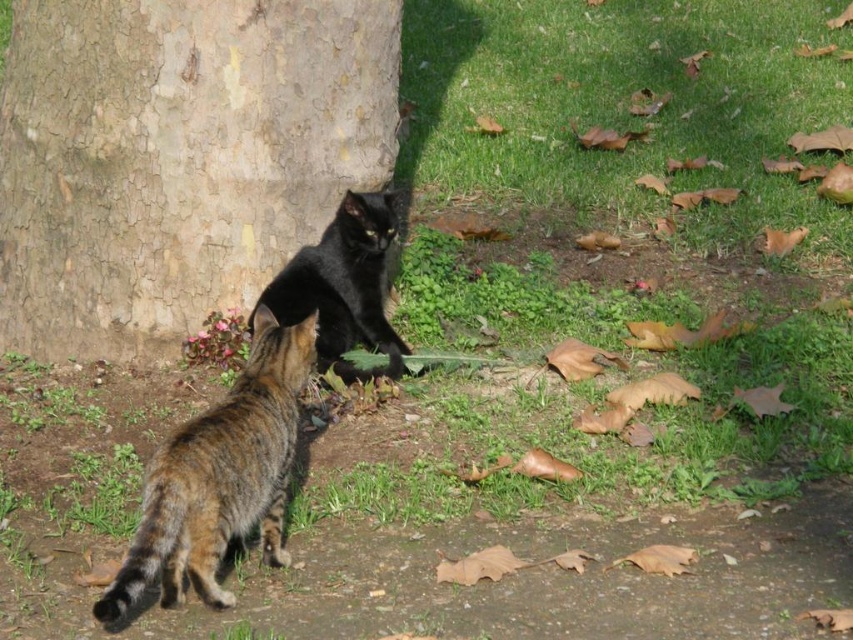
Question: Is smooth bark tree trunk at center positioned before tabby fur cat at lower left?

Choices:
 (A) yes
 (B) no

Answer: (B)

Question: Does tabby fur cat at lower left come behind shiny black cat at center?

Choices:
 (A) yes
 (B) no

Answer: (B)

Question: Which object is positioned farthest from the shiny black cat at center?

Choices:
 (A) smooth bark tree trunk at center
 (B) tabby fur cat at lower left

Answer: (B)

Question: Is the position of smooth bark tree trunk at center less distant than that of tabby fur cat at lower left?

Choices:
 (A) no
 (B) yes

Answer: (A)

Question: Among these points, which one is farthest from the camera?

Choices:
 (A) (189, 541)
 (B) (341, 275)
 (C) (273, 225)

Answer: (C)

Question: Which point appears closest to the camera in this image?

Choices:
 (A) (258, 509)
 (B) (0, 342)

Answer: (A)